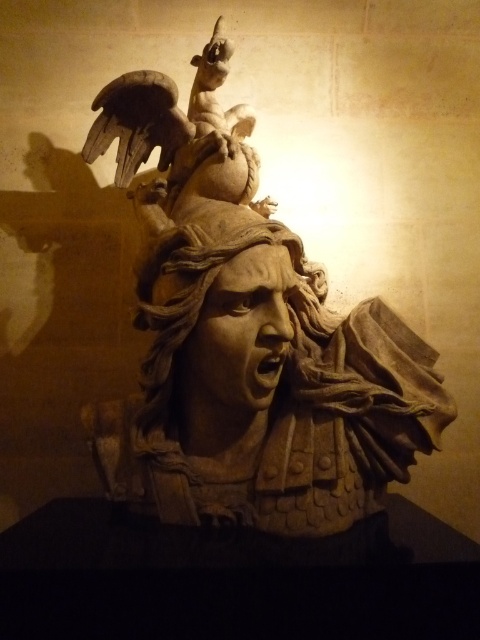
Question: Where is stone sculpture at center located in relation to carved stone head at center in the image?

Choices:
 (A) right
 (B) left

Answer: (B)

Question: Observing the image, what is the correct spatial positioning of stone sculpture at center in reference to carved stone head at center?

Choices:
 (A) left
 (B) right

Answer: (A)

Question: Among these objects, which one is farthest from the camera?

Choices:
 (A) carved stone head at center
 (B) stone sculpture at center

Answer: (A)

Question: Is stone sculpture at center smaller than carved stone head at center?

Choices:
 (A) no
 (B) yes

Answer: (A)

Question: Which point is farther to the camera?

Choices:
 (A) carved stone head at center
 (B) stone sculpture at center

Answer: (A)

Question: Which point is farther to the camera?

Choices:
 (A) stone sculpture at center
 (B) carved stone head at center

Answer: (B)